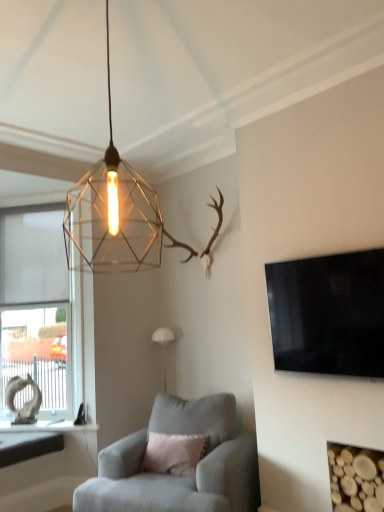
Question: Choose the correct answer: Is white matte window at left inside metallic wireframe pendant light at upper center, positioned as the 2th lamp in bottom-to-top order, or outside it?

Choices:
 (A) inside
 (B) outside

Answer: (B)

Question: Considering the positions of white matte window at left and metallic wireframe pendant light at upper center, acting as the 2th lamp starting from the back, in the image, is white matte window at left taller or shorter than metallic wireframe pendant light at upper center, acting as the 2th lamp starting from the back,?

Choices:
 (A) tall
 (B) short

Answer: (A)

Question: Which of these objects is positioned closest to the white matte window at left?

Choices:
 (A) metallic wireframe pendant light at upper center, positioned as the 2th lamp in bottom-to-top order
 (B) black glossy flat-screen tv at right
 (C) suede gray armchair at center
 (D) wooden logs at lower right
 (E) white matte lamp at center, arranged as the first lamp when viewed from the back

Answer: (E)

Question: Which object is positioned closest to the wooden logs at lower right?

Choices:
 (A) suede gray armchair at center
 (B) black glossy flat-screen tv at right
 (C) white matte lamp at center, which appears as the 1th lamp when ordered from the bottom
 (D) white matte window at left
 (E) metallic wireframe pendant light at upper center, positioned as the 2th lamp in bottom-to-top order

Answer: (B)